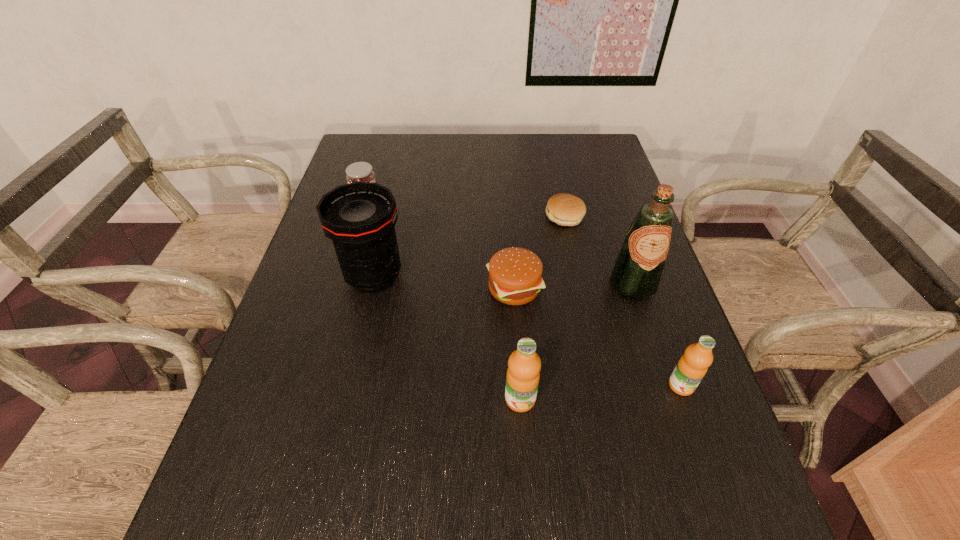
Find the location of a particular element. The width and height of the screenshot is (960, 540). the left orange juice is located at coordinates (523, 374).

Identify the location of the taller orange juice. (523, 374).

Where is `the shorter orange juice`? the shorter orange juice is located at coordinates (691, 368).

Identify the location of the fourth shortest object. The width and height of the screenshot is (960, 540). (691, 368).

Where is `the third shortest object`? The image size is (960, 540). the third shortest object is located at coordinates (360, 171).

At what (x,y) coordinates should I click in order to perform the action: click on the tallest object. Please return your answer as a coordinate pair (x, y). Looking at the image, I should click on (636, 274).

The image size is (960, 540). What are the coordinates of `the shortest object` in the screenshot? It's located at (564, 209).

I want to click on the third object from right to left, so click(564, 209).

The height and width of the screenshot is (540, 960). Identify the location of the second tallest object. (360, 217).

Image resolution: width=960 pixels, height=540 pixels. In order to click on hamburger in this screenshot , I will do `click(515, 274)`.